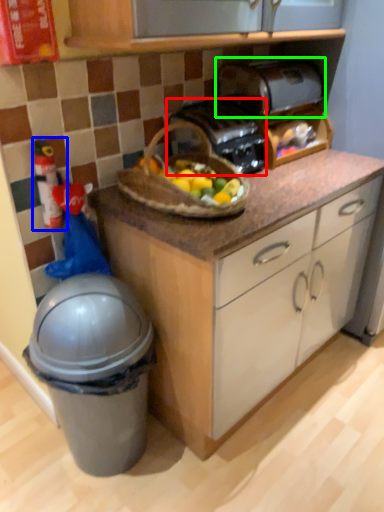
Question: Which object is the closest to the toaster (highlighted by a red box)? Choose among these: toy (highlighted by a blue box) or toaster (highlighted by a green box).

Choices:
 (A) toy
 (B) toaster

Answer: (B)